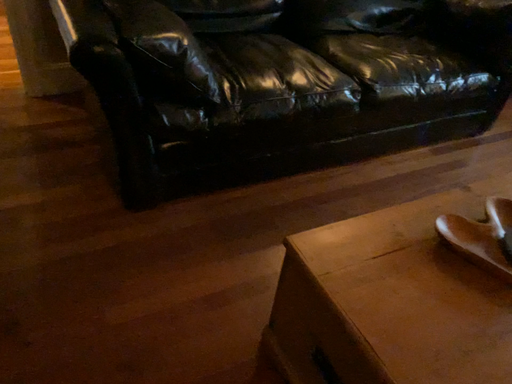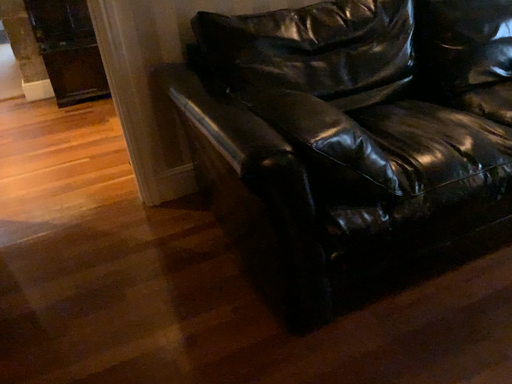
Question: Which way did the camera rotate in the video?

Choices:
 (A) rotated right
 (B) rotated left

Answer: (B)